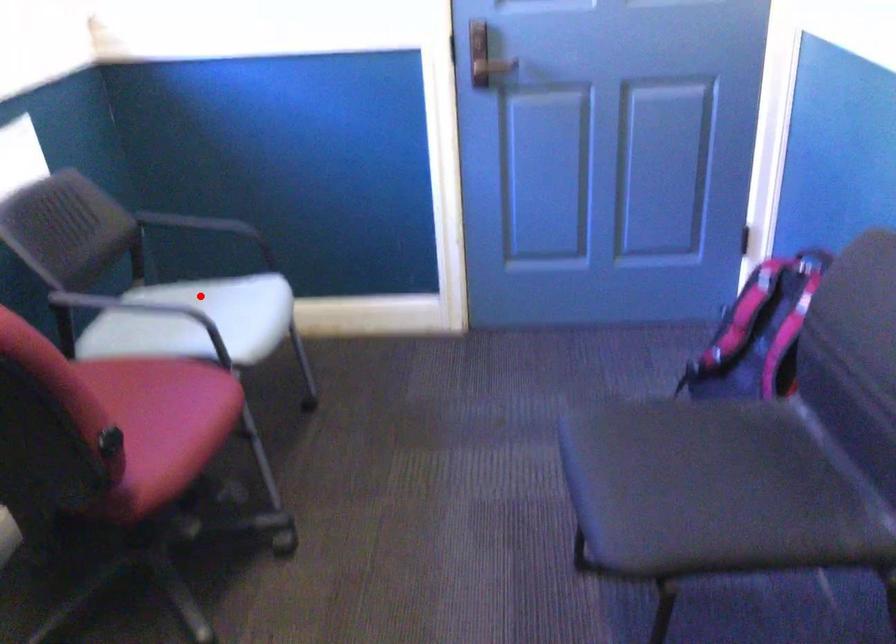
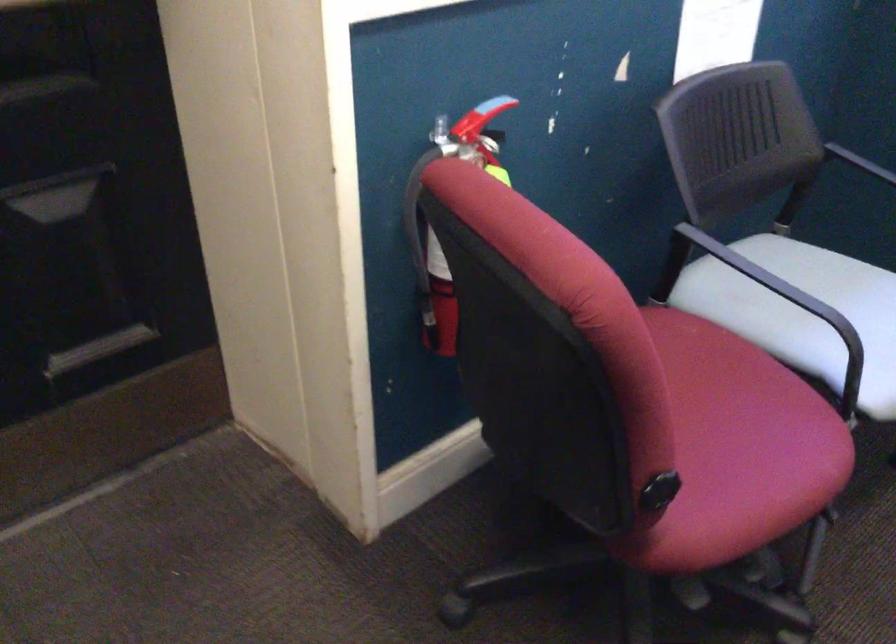
Question: I am providing you with two images of the same scene from different viewpoints. In image1, a red point is highlighted. Considering the same 3D point in image2, which of the following is correct?

Choices:
 (A) It is closer
 (B) It is farther

Answer: (A)